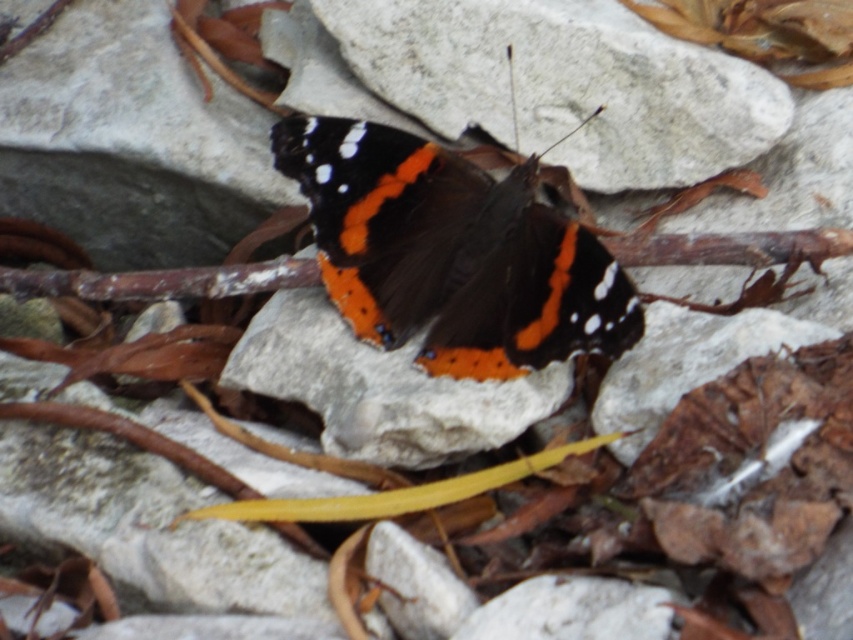
Is matte black and orange butterfly at center smaller than white rough stone at center?

Incorrect, matte black and orange butterfly at center is not smaller in size than white rough stone at center.

Who is higher up, matte black and orange butterfly at center or white rough stone at center?

white rough stone at center

Is point (454, 320) positioned behind point (457, 35)?

No, (454, 320) is in front of (457, 35).

In order to click on matte black and orange butterfly at center in this screenshot , I will do `click(451, 252)`.

Is white rough stone at center below matte gray stone at center?

Actually, white rough stone at center is above matte gray stone at center.

Identify the location of white rough stone at center. (566, 83).

Describe the element at coordinates (451, 252) in the screenshot. I see `matte black and orange butterfly at center` at that location.

The height and width of the screenshot is (640, 853). In order to click on matte black and orange butterfly at center in this screenshot , I will do `click(451, 252)`.

At what (x,y) coordinates should I click in order to perform the action: click on matte black and orange butterfly at center. Please return your answer as a coordinate pair (x, y). The image size is (853, 640). Looking at the image, I should click on (451, 252).